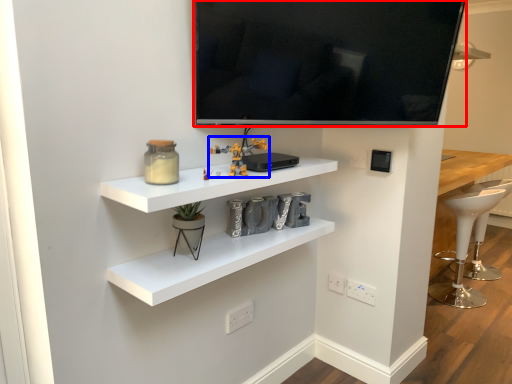
Question: Which point is closer to the camera, television (highlighted by a red box) or toy (highlighted by a blue box)?

Choices:
 (A) television
 (B) toy

Answer: (A)